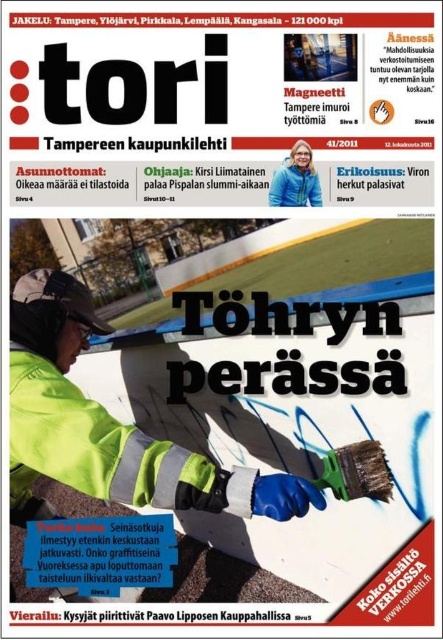
Question: Which object appears farthest from the camera in this image?

Choices:
 (A) green metallic brush at center
 (B) green fabric jacket at center

Answer: (A)

Question: Is green fabric jacket at center further to camera compared to green metallic brush at center?

Choices:
 (A) yes
 (B) no

Answer: (B)

Question: From the image, what is the correct spatial relationship of green fabric jacket at center in relation to green metallic brush at center?

Choices:
 (A) left
 (B) right

Answer: (A)

Question: Among these points, which one is farthest from the camera?

Choices:
 (A) (364, 444)
 (B) (85, 413)

Answer: (A)

Question: Does green fabric jacket at center appear under green metallic brush at center?

Choices:
 (A) no
 (B) yes

Answer: (B)